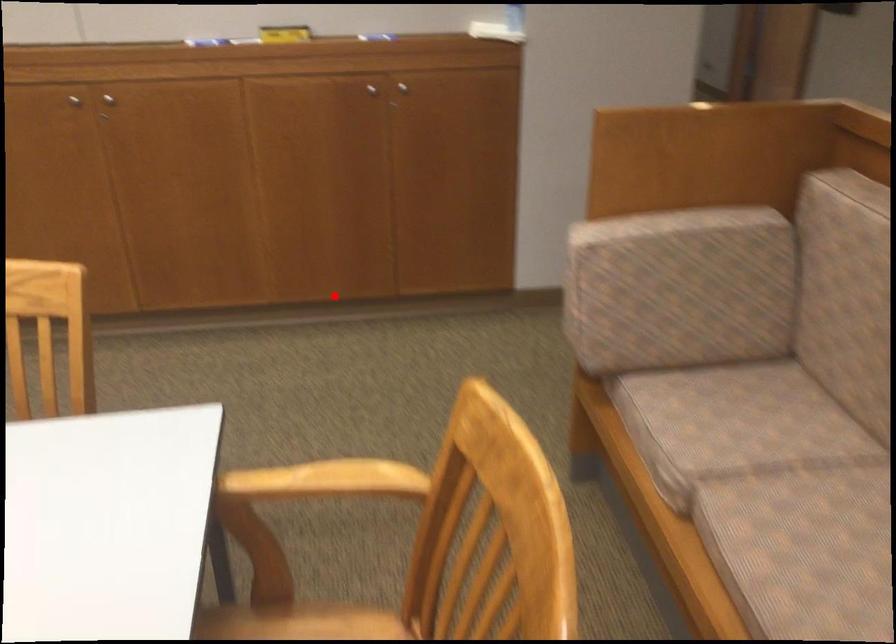
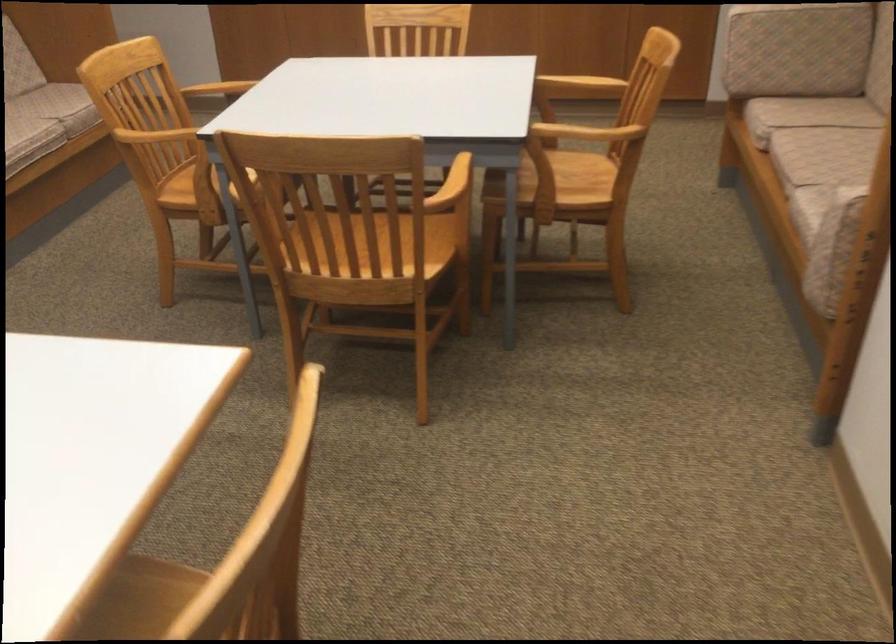
In the second image, find the point that corresponds to the highlighted location in the first image.

(580, 84)